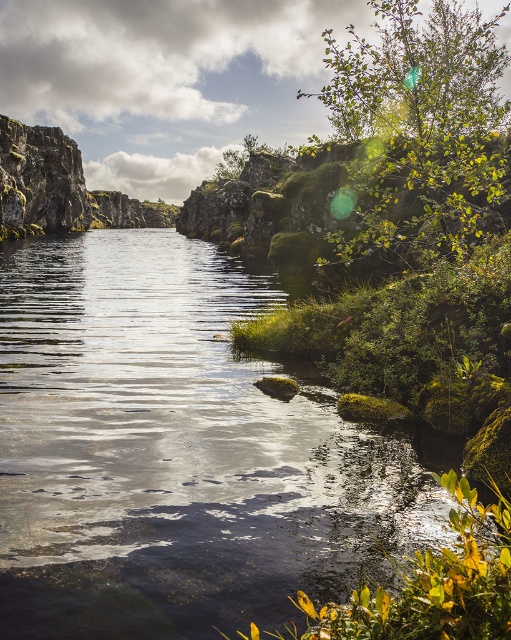
Is green leafy tree at upper right taller than green leafy plant at lower right?

Yes.

Where is `green leafy tree at upper right`? green leafy tree at upper right is located at coordinates (421, 125).

Does point (449, 8) lie in front of point (471, 490)?

No, it is not.

Where is `green leafy tree at upper right`? green leafy tree at upper right is located at coordinates 421,125.

Which of these two, clear water at center or green leafy plant at lower right, stands shorter?

green leafy plant at lower right is shorter.

Who is more forward, (265, 396) or (507, 544)?

Point (507, 544) is more forward.

Locate an element on the screen. clear water at center is located at coordinates (176, 451).

Can you confirm if clear water at center is smaller than green leafy tree at upper right?

Indeed, clear water at center has a smaller size compared to green leafy tree at upper right.

What do you see at coordinates (176, 451) in the screenshot? I see `clear water at center` at bounding box center [176, 451].

Image resolution: width=511 pixels, height=640 pixels. I want to click on clear water at center, so click(x=176, y=451).